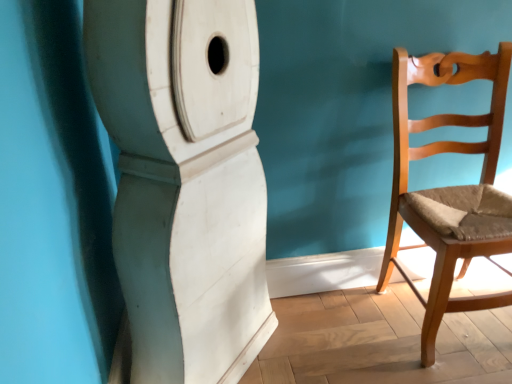
What do you see at coordinates (185, 182) in the screenshot? This screenshot has height=384, width=512. I see `white matte pillar at center` at bounding box center [185, 182].

Locate an element on the screen. white matte pillar at center is located at coordinates (185, 182).

The height and width of the screenshot is (384, 512). In order to click on light brown wood chair at right in this screenshot , I will do `click(448, 187)`.

This screenshot has height=384, width=512. Describe the element at coordinates (448, 187) in the screenshot. I see `light brown wood chair at right` at that location.

The image size is (512, 384). Identify the location of white matte pillar at center. (185, 182).

Which object is positioned more to the left, light brown wood chair at right or white matte pillar at center?

white matte pillar at center.

Considering their positions, is light brown wood chair at right located in front of or behind white matte pillar at center?

light brown wood chair at right is positioned farther from the viewer than white matte pillar at center.

Is point (421, 344) positioned in front of point (246, 310)?

Yes.

From the image's perspective, relative to white matte pillar at center, is light brown wood chair at right above or below?

light brown wood chair at right is situated higher than white matte pillar at center in the image.

From a real-world perspective, is light brown wood chair at right positioned above or below white matte pillar at center?

From a real-world perspective, light brown wood chair at right is physically below white matte pillar at center.

Between light brown wood chair at right and white matte pillar at center, which one has larger width?

white matte pillar at center is wider.

Considering the sizes of objects light brown wood chair at right and white matte pillar at center in the image provided, who is shorter, light brown wood chair at right or white matte pillar at center?

Standing shorter between the two is light brown wood chair at right.

Is light brown wood chair at right bigger or smaller than white matte pillar at center?

light brown wood chair at right is smaller than white matte pillar at center.

From the picture: Is white matte pillar at center located within light brown wood chair at right?

No, white matte pillar at center is not a part of light brown wood chair at right.

Are light brown wood chair at right and white matte pillar at center located far from each other?

That's not correct — light brown wood chair at right is a little close to white matte pillar at center.

Is light brown wood chair at right looking in the opposite direction of white matte pillar at center?

light brown wood chair at right is not turned away from white matte pillar at center.

Find the location of a particular element. Image resolution: width=512 pixels, height=384 pixels. chair that appears on the right of white matte pillar at center is located at coordinates (448, 187).

Can you confirm if white matte pillar at center is positioned to the right of light brown wood chair at right?

In fact, white matte pillar at center is to the left of light brown wood chair at right.

Which object is more forward, white matte pillar at center or light brown wood chair at right?

white matte pillar at center is in front.

Is point (130, 106) closer to viewer compared to point (407, 144)?

Yes, it is.

From the image's perspective, is white matte pillar at center on light brown wood chair at right?

No, from the image's perspective, white matte pillar at center is not on top of light brown wood chair at right.

From a real-world perspective, is white matte pillar at center below light brown wood chair at right?

No, from a real-world perspective, white matte pillar at center is not below light brown wood chair at right.

Which object is wider, white matte pillar at center or light brown wood chair at right?

With larger width is white matte pillar at center.

Is white matte pillar at center taller or shorter than light brown wood chair at right?

Considering their sizes, white matte pillar at center has more height than light brown wood chair at right.

Considering the sizes of white matte pillar at center and light brown wood chair at right in the image, is white matte pillar at center bigger or smaller than light brown wood chair at right?

white matte pillar at center is bigger than light brown wood chair at right.

Is white matte pillar at center outside of light brown wood chair at right?

Yes, white matte pillar at center is not within light brown wood chair at right.

Is white matte pillar at center placed right next to light brown wood chair at right?

No.

Is white matte pillar at center oriented towards light brown wood chair at right?

Yes, white matte pillar at center is turned towards light brown wood chair at right.

Measure the distance between white matte pillar at center and light brown wood chair at right.

They are 27.72 inches apart.

In order to click on pillar in front of the light brown wood chair at right in this screenshot , I will do `click(185, 182)`.

Where is `pillar that appears below the light brown wood chair at right (from the image's perspective)`? Image resolution: width=512 pixels, height=384 pixels. pillar that appears below the light brown wood chair at right (from the image's perspective) is located at coordinates (185, 182).

In order to click on chair located above the white matte pillar at center (from the image's perspective) in this screenshot , I will do `click(448, 187)`.